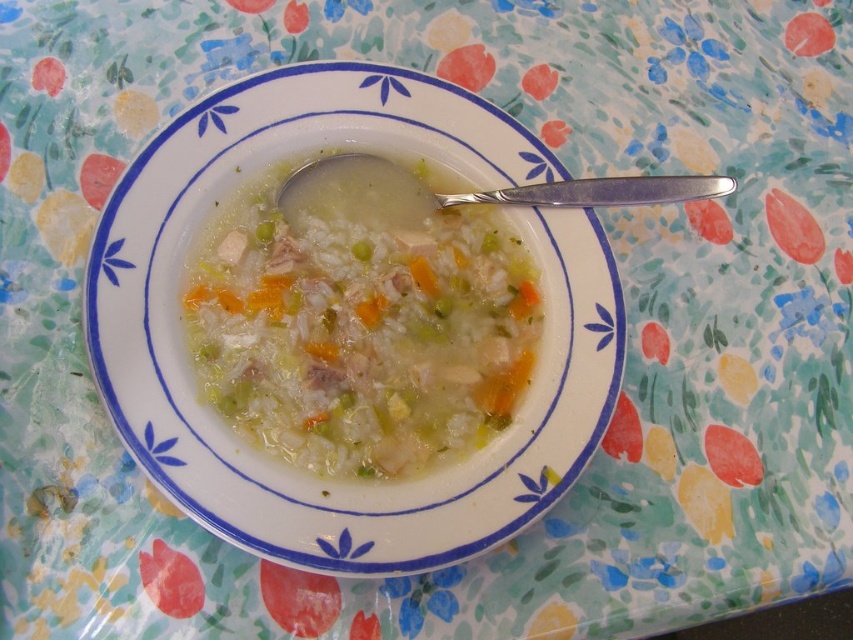
You are at a casual outdoor dining area and see the white creamy soup at center and the silver metallic spoon at center. Which object is positioned lower in the image?

The white creamy soup at center is located below the silver metallic spoon at center, so the white creamy soup at center is positioned lower in the image.

You are a food photographer setting up a shot of the white creamy soup at center and the silver metallic spoon at center. You want to focus on the soup first. Which object should you adjust the camera focus to first?

The white creamy soup at center is closer to the viewer than the silver metallic spoon at center, so you should adjust the camera focus to the white creamy soup at center first to ensure it is in focus before the spoon.

You are at a picnic and have a white creamy soup at center and a silver metallic spoon at center in front of you. If you want to eat the soup, will the spoon fit entirely inside the soup?

The white creamy soup at center is narrower than the silver metallic spoon at center, so the spoon will not fit entirely inside the soup.